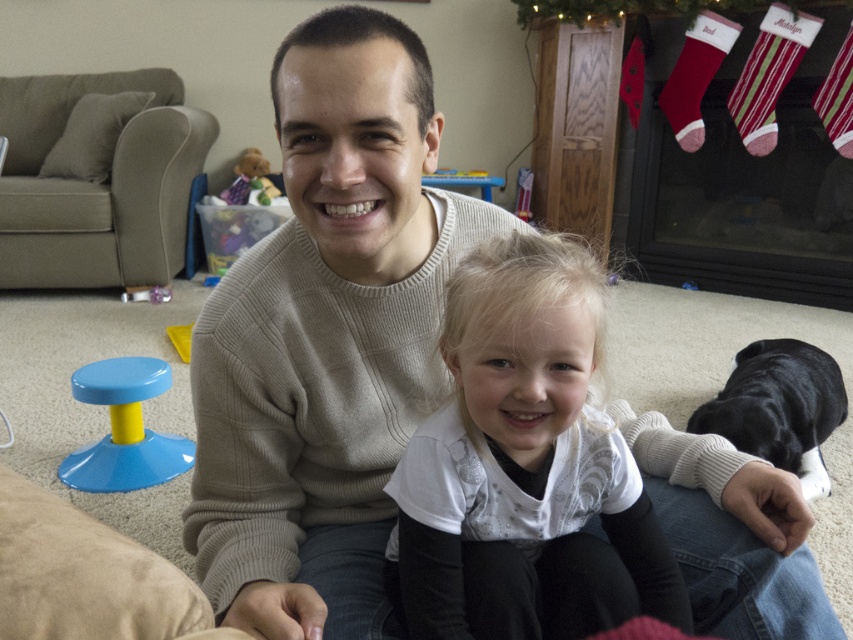
What is the object located at the coordinates point (525,467)?

The object located at point (525,467) is the white matte shirt at center.

In the scene shown: You are a delivery person holding a large package that requires a flat surface to place. You see the blue plastic stool at lower left in the living room. Can you put the package on the stool?

The blue plastic stool at lower left is 1.73 meters away from you. Since the stool is a flat surface, you can place the package on it.

You are a guest entering the living room and want to sit down. You see the black smooth dog at lower right and the blue plastic stool at lower left. Which one is taller? Please choose between the two.

The black smooth dog at lower right is taller than the blue plastic stool at lower left.